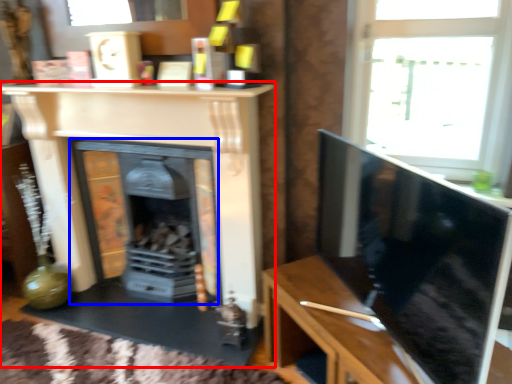
Question: Which object is closer to the camera taking this photo, fireplace (highlighted by a red box) or fireplace (highlighted by a blue box)?

Choices:
 (A) fireplace
 (B) fireplace

Answer: (A)